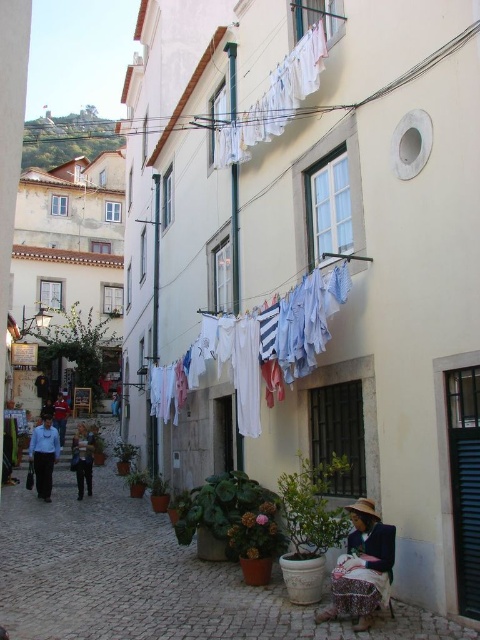
You are a traveler passing by the street scene and notice the plaid fabric skirt at lower right and the red fabric jacket at left hanging on the clothesline. Which item of clothing is smaller in size?

The plaid fabric skirt at lower right is smaller in size compared to the red fabric jacket at left.

You are standing on the cobblestone street and want to take a photo of both the clothesline and the potted plants. Which point should you focus on first to ensure both are in focus? The two points are point 1 at [165,596] and point 2 at [372,506]. Please choose between point 1 or point 2.

You should focus on point 1 at [165,596] first because it is closer to the camera than point 2 at [372,506]. This ensures both objects are within the depth of field.

You are a tourist standing at the entrance of the street scene, and you want to find the matte concrete alley at center. Based on the coordinates provided, can you determine the direction you should walk to reach it?

The matte concrete alley at center is located at coordinates point (145,579). Since the coordinate system typically places the origin at the bottom left corner, the x value of 0.905 indicates a position far to the right, and the y value of 0.304 suggests it is halfway up the image vertically. Therefore, you should walk towards the right side of the scene to reach the matte concrete alley at center.